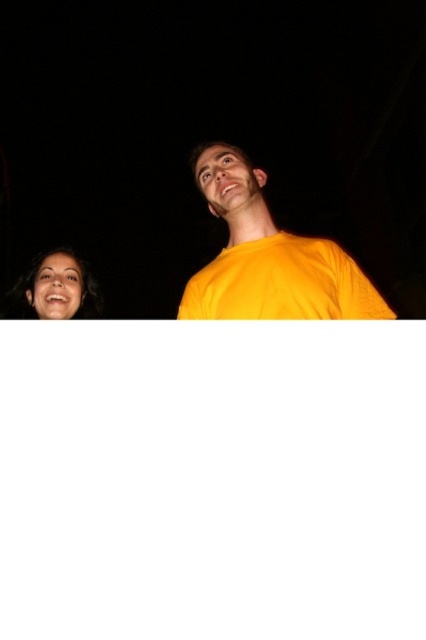
You are a photographer trying to capture the perfect shot of the two people in the image. You want to ensure that the yellow matte shirt at center and the matte black face at lower left are both clearly visible in the frame. Based on their positions, which object should you focus on first to ensure proper exposure?

The yellow matte shirt at center is above the matte black face at lower left, so focusing on the yellow matte shirt at center first would ensure proper exposure since it is closer to the light source, making it brighter and easier to capture details without overexposing the darker matte black face at lower left.

You are a photographer adjusting the lighting for a night portrait. You notice the yellow matte shirt at center and the matte black face at lower left in your frame. Which object is located to the right of the other?

The yellow matte shirt at center is positioned on the right side of matte black face at lower left.